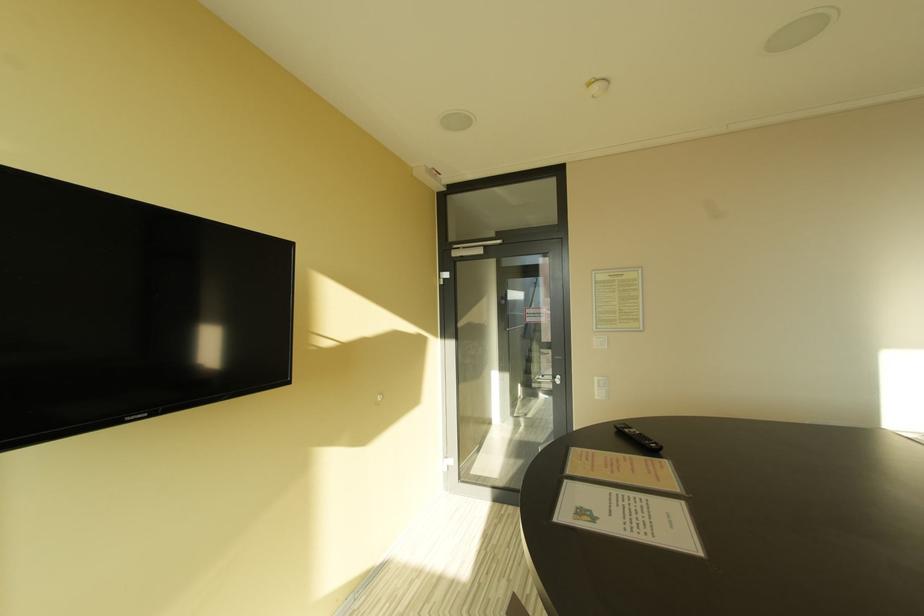
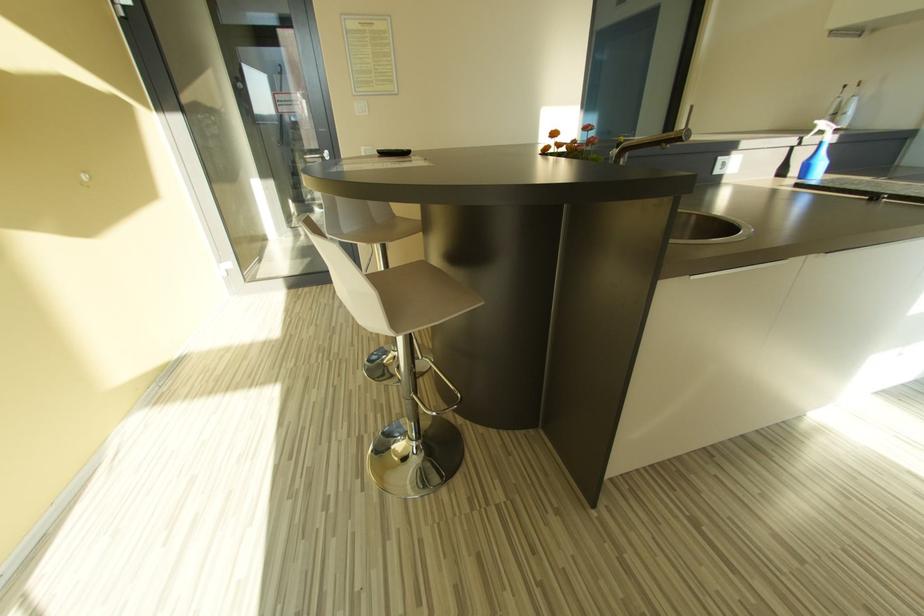
Based on the continuous images, in which direction is the camera rotating?

The camera's rotation is toward right-down.